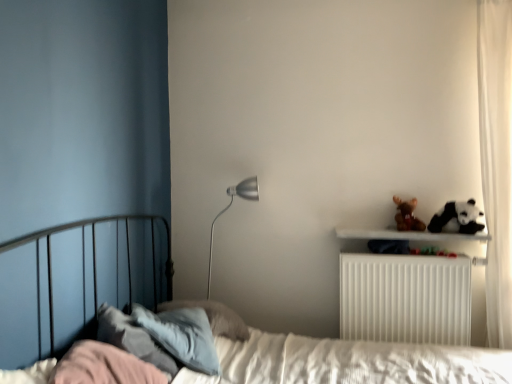
Measure the distance between white sheer curtain at right and camera.

They are 2.23 meters apart.

This screenshot has height=384, width=512. What do you see at coordinates (229, 207) in the screenshot?
I see `silver metallic floor lamp at center` at bounding box center [229, 207].

Measure the distance between silver metallic floor lamp at center and camera.

The depth of silver metallic floor lamp at center is 2.51 meters.

This screenshot has width=512, height=384. What are the coordinates of `brown plush bear at upper right` in the screenshot? It's located at (407, 215).

Identify the location of white sheer curtain at right. The width and height of the screenshot is (512, 384). (496, 161).

Does white quilted bed at center come in front of white plastic radiator at upper right?

Yes, the depth of white quilted bed at center is less than that of white plastic radiator at upper right.

In the image, there is a white quilted bed at center. At what (x,y) coordinates should I click in order to perform the action: click on radiator above it (from the image's perspective). Please return your answer as a coordinate pair (x, y). Looking at the image, I should click on (405, 298).

Does white quilted bed at center have a larger size compared to white plastic radiator at upper right?

Yes, white quilted bed at center is bigger than white plastic radiator at upper right.

Considering the relative positions of white quilted bed at center and white plastic radiator at upper right in the image provided, is white quilted bed at center to the left or to the right of white plastic radiator at upper right?

Based on their positions, white quilted bed at center is located to the left of white plastic radiator at upper right.

Is white sheer curtain at right smaller than black and white plush panda at upper right?

No, white sheer curtain at right is not smaller than black and white plush panda at upper right.

From the image's perspective, is white sheer curtain at right below black and white plush panda at upper right?

No.

Considering the points (483, 79) and (466, 218), which point is in front, point (483, 79) or point (466, 218)?

The point (483, 79) is closer.

Is white plastic radiator at upper right placed right next to black and white plush panda at upper right?

No, white plastic radiator at upper right is not with black and white plush panda at upper right.

From the picture: Is white plastic radiator at upper right taller than black and white plush panda at upper right?

Indeed, white plastic radiator at upper right has a greater height compared to black and white plush panda at upper right.

I want to click on animal above the white plastic radiator at upper right (from a real-world perspective), so click(458, 217).

Considering the relative sizes of white plastic radiator at upper right and black and white plush panda at upper right in the image provided, is white plastic radiator at upper right wider than black and white plush panda at upper right?

In fact, white plastic radiator at upper right might be narrower than black and white plush panda at upper right.

Can you confirm if white sheer curtain at right is bigger than white plastic radiator at upper right?

Correct, white sheer curtain at right is larger in size than white plastic radiator at upper right.

Consider the image. From a real-world perspective, is white sheer curtain at right located higher than white plastic radiator at upper right?

Yes, from a real-world perspective, white sheer curtain at right is on top of white plastic radiator at upper right.

Does white sheer curtain at right have a greater height compared to white plastic radiator at upper right?

Yes, white sheer curtain at right is taller than white plastic radiator at upper right.

Can you tell me how much white sheer curtain at right and white plastic radiator at upper right differ in facing direction?

white sheer curtain at right and white plastic radiator at upper right are facing 4.26 degrees away from each other.

Which of these two, brown plush bear at upper right or silver metallic floor lamp at center, is wider?

silver metallic floor lamp at center is wider.

From the picture: Would you consider brown plush bear at upper right to be distant from silver metallic floor lamp at center?

No.

From a real-world perspective, between brown plush bear at upper right and silver metallic floor lamp at center, who is vertically lower?

From a 3D spatial view, silver metallic floor lamp at center is below.

From the image's perspective, is brown plush bear at upper right below silver metallic floor lamp at center?

Incorrect, from the image's perspective, brown plush bear at upper right is higher than silver metallic floor lamp at center.

Locate an element on the screen. The height and width of the screenshot is (384, 512). bed beneath the white plastic radiator at upper right (from a real-world perspective) is located at coordinates (340, 359).

From the image's perspective, relative to white quilted bed at center, is white plastic radiator at upper right above or below?

Based on their image positions, white plastic radiator at upper right is located above white quilted bed at center.

Which of these two, white plastic radiator at upper right or white quilted bed at center, is thinner?

white plastic radiator at upper right is thinner.

Is white plastic radiator at upper right facing towards white quilted bed at center?

Yes.

Is point (471, 209) farther from viewer compared to point (511, 141)?

Yes, point (471, 209) is farther from viewer.

Would you consider black and white plush panda at upper right to be distant from white sheer curtain at right?

No, black and white plush panda at upper right is not far away from white sheer curtain at right.

Looking at this image, considering the positions of objects black and white plush panda at upper right and white sheer curtain at right in the image provided, who is more to the left, black and white plush panda at upper right or white sheer curtain at right?

Positioned to the left is black and white plush panda at upper right.

I want to click on bed on the left of white plastic radiator at upper right, so click(340, 359).

Where is `curtain above the black and white plush panda at upper right (from a real-world perspective)`? The height and width of the screenshot is (384, 512). curtain above the black and white plush panda at upper right (from a real-world perspective) is located at coordinates (496, 161).

Estimate the real-world distances between objects in this image. Which object is closer to brown plush bear at upper right, white plastic radiator at upper right or silver metallic floor lamp at center?

white plastic radiator at upper right.

Looking at the image, which one is located further to white sheer curtain at right, brown plush bear at upper right or white quilted bed at center?

The object further to white sheer curtain at right is white quilted bed at center.

Looking at the image, which one is located closer to black and white plush panda at upper right, white quilted bed at center or white plastic radiator at upper right?

white plastic radiator at upper right.

Which object lies further to the anchor point white quilted bed at center, white plastic radiator at upper right or white sheer curtain at right?

Among the two, white sheer curtain at right is located further to white quilted bed at center.

Estimate the real-world distances between objects in this image. Which object is closer to brown plush bear at upper right, black and white plush panda at upper right or silver metallic floor lamp at center?

Among the two, black and white plush panda at upper right is located nearer to brown plush bear at upper right.

Estimate the real-world distances between objects in this image. Which object is closer to brown plush bear at upper right, white sheer curtain at right or white quilted bed at center?

white sheer curtain at right is closer to brown plush bear at upper right.

Looking at the image, which one is located further to white quilted bed at center, white sheer curtain at right or white plastic radiator at upper right?

white sheer curtain at right.

Looking at the image, which one is located further to white quilted bed at center, white sheer curtain at right or silver metallic floor lamp at center?

silver metallic floor lamp at center.

In order to click on toy between white sheer curtain at right and white plastic radiator at upper right in the up-down direction in this screenshot , I will do `click(407, 215)`.

At what (x,y) coordinates should I click in order to perform the action: click on toy between silver metallic floor lamp at center and black and white plush panda at upper right. Please return your answer as a coordinate pair (x, y). Image resolution: width=512 pixels, height=384 pixels. Looking at the image, I should click on (407, 215).

This screenshot has height=384, width=512. Identify the location of curtain positioned between white quilted bed at center and white plastic radiator at upper right from near to far. (496, 161).

The width and height of the screenshot is (512, 384). I want to click on animal positioned between white quilted bed at center and brown plush bear at upper right from near to far, so click(x=458, y=217).